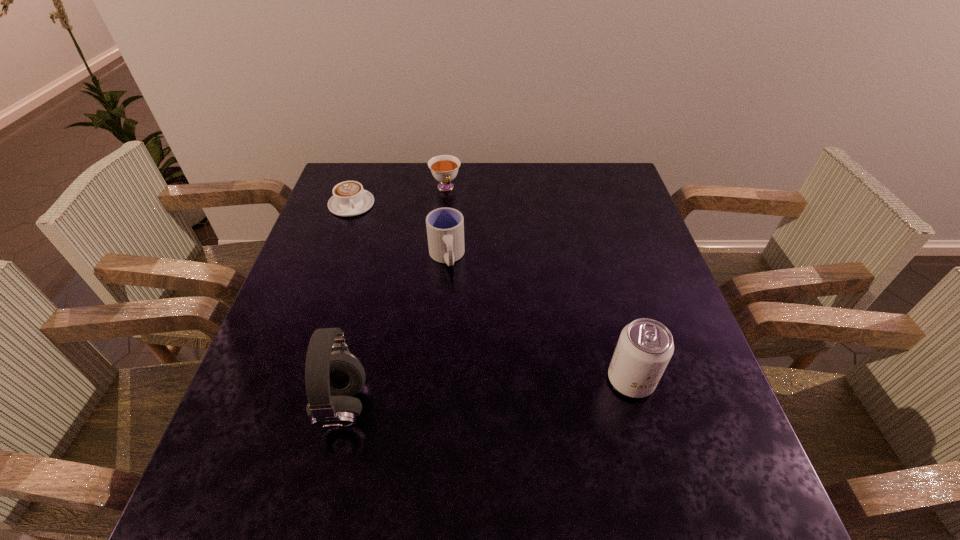
Locate an element on the screen. vacant space at the right edge of the desktop is located at coordinates (606, 264).

Image resolution: width=960 pixels, height=540 pixels. In order to click on blank space at the far left corner of the desktop in this screenshot , I will do `click(380, 193)`.

At what (x,y) coordinates should I click in order to perform the action: click on unoccupied area between the third shortest object and the headset. Please return your answer as a coordinate pair (x, y). Looking at the image, I should click on (395, 332).

Locate an element on the screen. This screenshot has height=540, width=960. vacant space that's between the rightmost object and the third nearest object is located at coordinates (539, 319).

Find the location of a particular element. The height and width of the screenshot is (540, 960). free area in between the soda can and the second shortest object is located at coordinates click(x=539, y=284).

At what (x,y) coordinates should I click in order to perform the action: click on vacant area that lies between the fourth shortest object and the fourth tallest object. Please return your answer as a coordinate pair (x, y). This screenshot has width=960, height=540. Looking at the image, I should click on 539,284.

The height and width of the screenshot is (540, 960). I want to click on free space between the leftmost object and the rightmost object, so click(x=492, y=292).

Where is `free area in between the soda can and the second shortest object`? The height and width of the screenshot is (540, 960). free area in between the soda can and the second shortest object is located at coordinates (539, 284).

This screenshot has height=540, width=960. I want to click on vacant space that's between the second shortest object and the rightmost object, so click(x=539, y=284).

The height and width of the screenshot is (540, 960). In order to click on object that is the third closest to the cappuccino in this screenshot , I will do `click(333, 375)`.